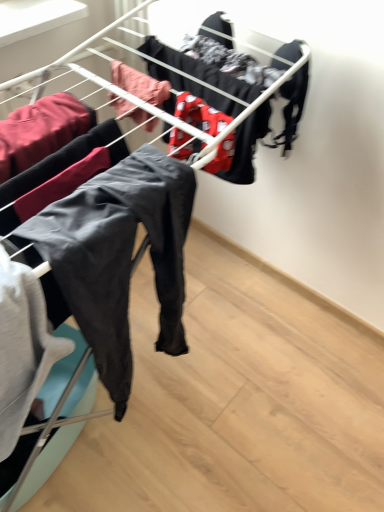
Question: Is point coord(286,84) closer or farther from the camera than point coord(6,125)?

Choices:
 (A) closer
 (B) farther

Answer: (B)

Question: In the image, is black matte underwear at upper right, the 5th clothing from the left, on the left side or the right side of matte black pants at left, the 1th clothing positioned from the left?

Choices:
 (A) left
 (B) right

Answer: (B)

Question: Which object is the closest to the matte black pants at center, which is the second clothing from left to right?

Choices:
 (A) matte black pants at left, the 5th clothing positioned from the right
 (B) pink fabric at center, which appears as the third clothing when viewed from the left
 (C) black matte underwear at upper right, the first clothing in the right-to-left sequence
 (D) red fabric with white patterns at center, marked as the second clothing in a right-to-left arrangement

Answer: (D)

Question: Based on their relative distances, which object is farther from the matte black pants at center, positioned as the fourth clothing in right-to-left order?

Choices:
 (A) pink fabric at center, which appears as the third clothing when viewed from the left
 (B) matte black pants at left, the 1th clothing positioned from the left
 (C) red fabric with white patterns at center, marked as the second clothing in a right-to-left arrangement
 (D) black matte underwear at upper right, the first clothing in the right-to-left sequence

Answer: (D)